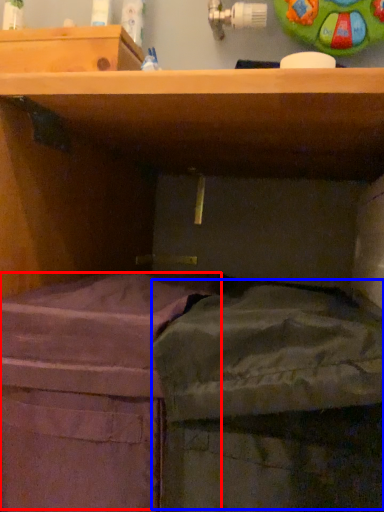
Question: Which object is further to the camera taking this photo, wide (highlighted by a red box) or wide (highlighted by a blue box)?

Choices:
 (A) wide
 (B) wide

Answer: (A)